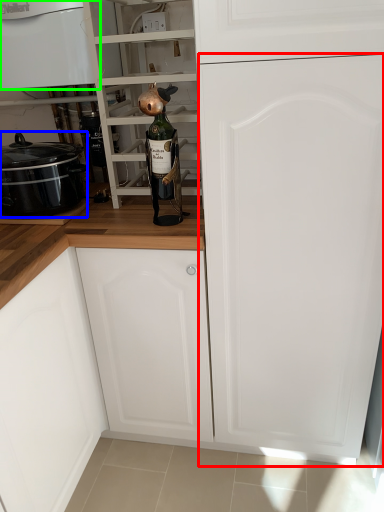
Question: Which object is positioned farthest from door (highlighted by a red box)? Select from kitchen appliance (highlighted by a blue box) and home appliance (highlighted by a green box).

Choices:
 (A) kitchen appliance
 (B) home appliance

Answer: (B)